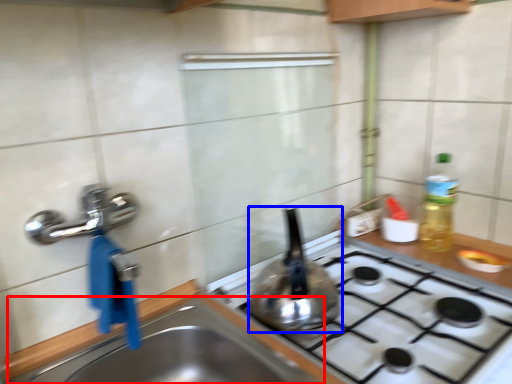
Question: Which point is closer to the camera, sink (highlighted by a red box) or kitchen appliance (highlighted by a blue box)?

Choices:
 (A) sink
 (B) kitchen appliance

Answer: (A)